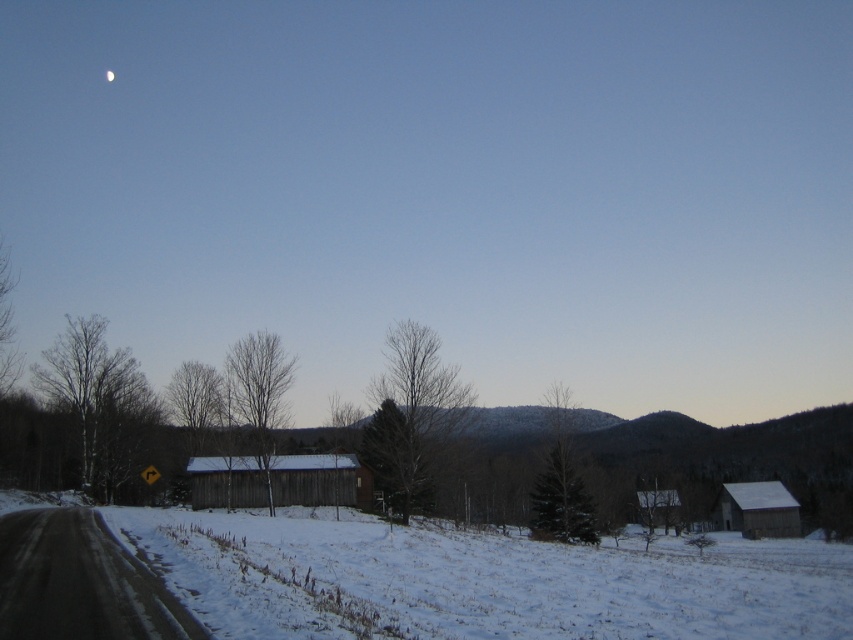
Between white fluffy snow at lower center and white glossy moon at upper center, which one is positioned lower?

white fluffy snow at lower center

Measure the distance between white fluffy snow at lower center and camera.

white fluffy snow at lower center is 27.66 feet away from camera.

Find the location of a particular element. The height and width of the screenshot is (640, 853). white fluffy snow at lower center is located at coordinates (483, 582).